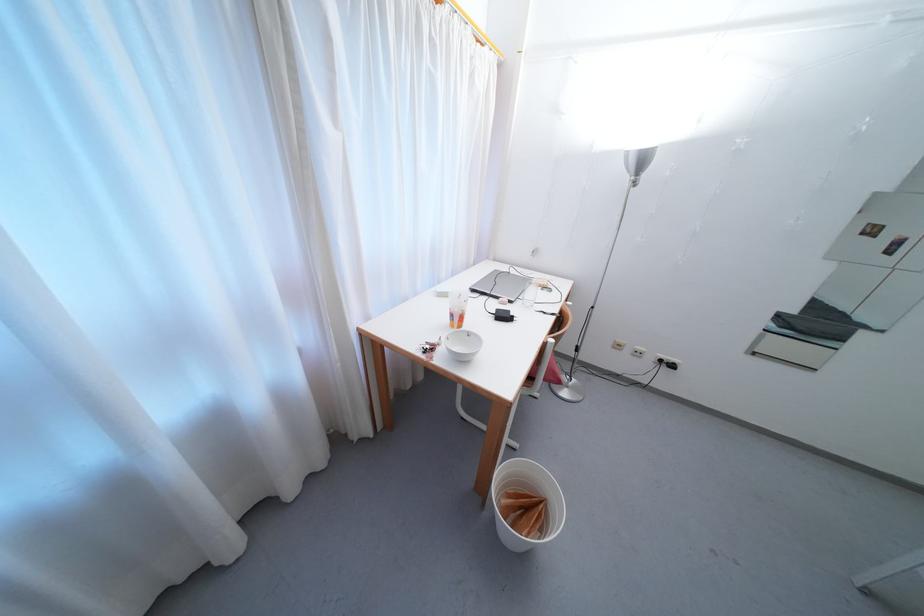
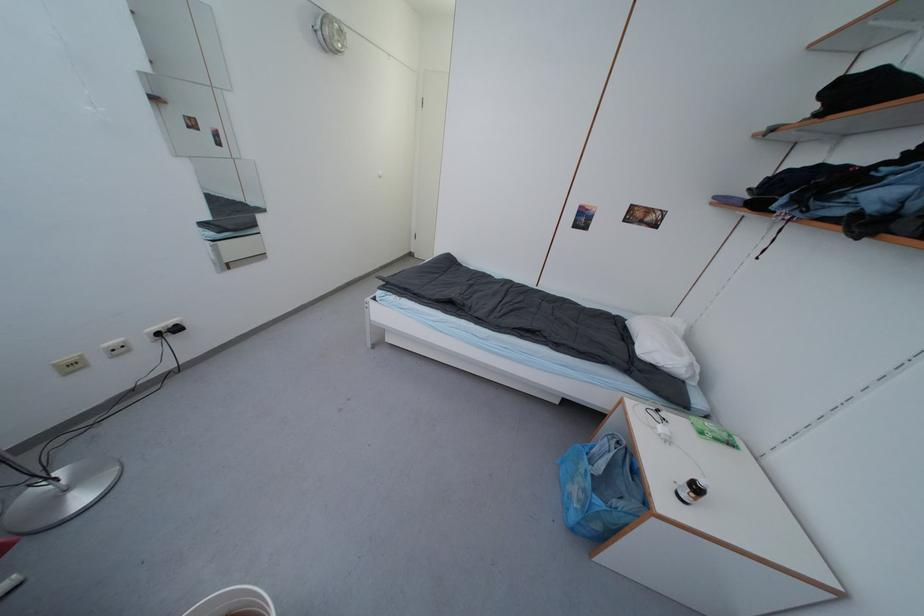
Based on the continuous images, in which direction is the camera rotating?

The rotation direction of the camera is right-down.